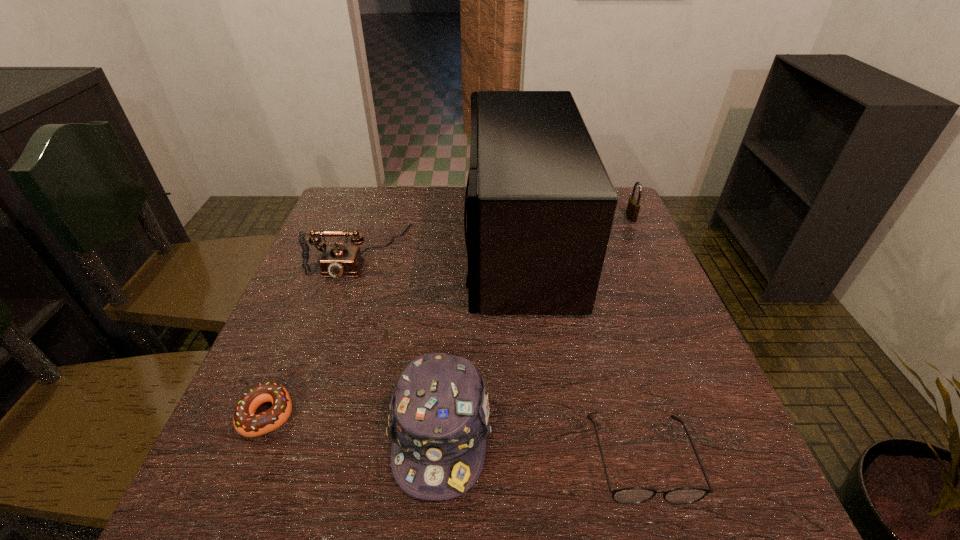
Identify which object is the fourth closest to the padlock. Please provide its 2D coordinates. Your answer should be formatted as a tuple, i.e. [(x, y)], where the tuple contains the x and y coordinates of a point satisfying the conditions above.

[(438, 422)]

Find the location of a particular element. This screenshot has height=540, width=960. vacant point that satisfies the following two spatial constraints: 1. on the front-facing side of the tallest object; 2. on the front-facing side of the headwear is located at coordinates (541, 432).